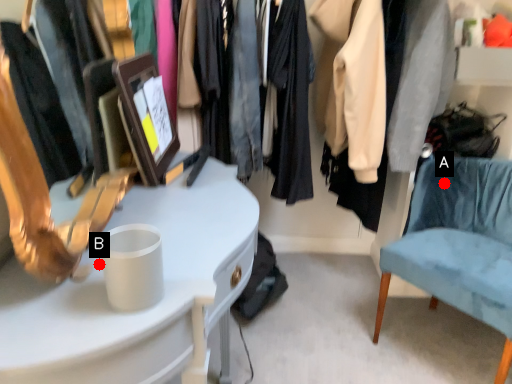
Question: Two points are circled on the image, labeled by A and B beside each circle. Which point is closer to the camera?

Choices:
 (A) A is closer
 (B) B is closer

Answer: (B)